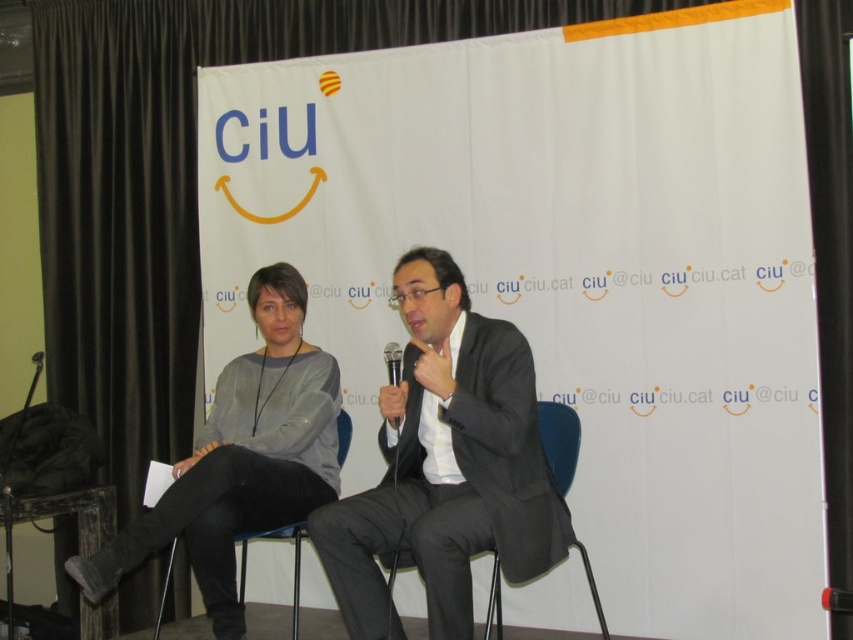
Is the position of gray sweater at center less distant than that of black plastic chair at lower left?

Yes, gray sweater at center is in front of black plastic chair at lower left.

Between gray sweater at center and black plastic chair at lower left, which one is positioned higher?

gray sweater at center

The width and height of the screenshot is (853, 640). Describe the element at coordinates (242, 458) in the screenshot. I see `gray sweater at center` at that location.

I want to click on gray sweater at center, so click(242, 458).

Does blue fabric chair at center appear under black plastic chair at lower left?

Actually, blue fabric chair at center is above black plastic chair at lower left.

The image size is (853, 640). I want to click on blue fabric chair at center, so click(x=560, y=440).

Is point (425, 436) farther from camera compared to point (231, 465)?

Yes.

Does dark gray suit at center have a smaller size compared to gray sweater at center?

Yes, dark gray suit at center is smaller than gray sweater at center.

Is point (474, 420) positioned behind point (184, 525)?

That is False.

This screenshot has width=853, height=640. I want to click on dark gray suit at center, so click(x=445, y=465).